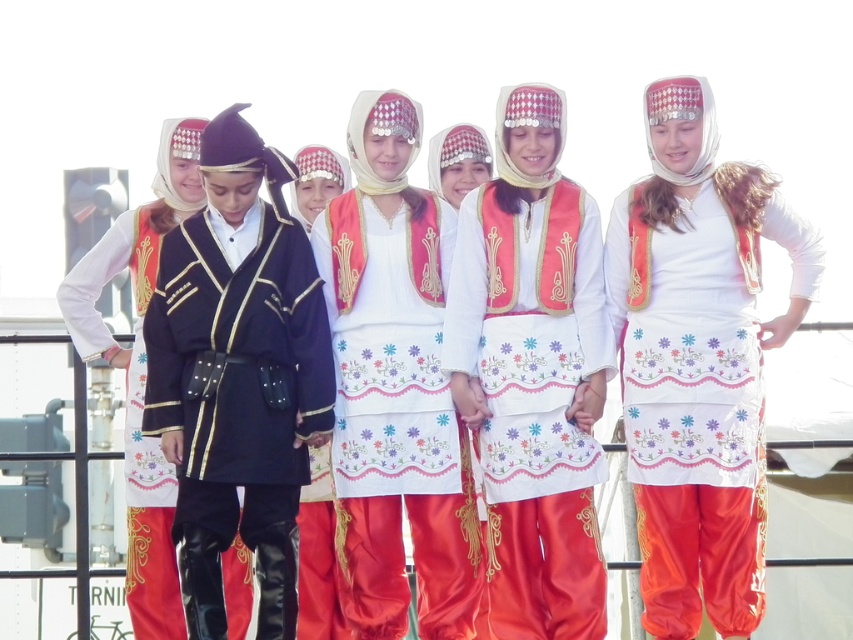
Does white satin skirt at center come in front of matte black vest at left?

Yes, it is in front of matte black vest at left.

Between white satin skirt at center and matte black vest at left, which one is positioned lower?

Positioned lower is matte black vest at left.

Is point (695, 221) positioned before point (67, 323)?

Yes, point (695, 221) is closer to viewer.

Identify the location of white satin skirt at center. (698, 360).

Measure the distance between point (303, 444) and camera.

Point (303, 444) and camera are 69.76 meters apart.

Can you confirm if shiny black coat at center is shorter than white satin dress at center?

Indeed, shiny black coat at center has a lesser height compared to white satin dress at center.

Measure the distance between point [202,468] and camera.

67.36 meters

Where is `shiny black coat at center`? The height and width of the screenshot is (640, 853). shiny black coat at center is located at coordinates (238, 376).

Is embroidered silk dress at center taller than matte black vest at left?

Indeed, embroidered silk dress at center has a greater height compared to matte black vest at left.

Is point (556, 152) closer to camera compared to point (199, 208)?

That is True.

Measure the distance between point (531, 84) and camera.

Point (531, 84) and camera are 235.15 feet apart.

At what (x,y) coordinates should I click in order to perform the action: click on embroidered silk dress at center. Please return your answer as a coordinate pair (x, y). Looking at the image, I should click on (532, 372).